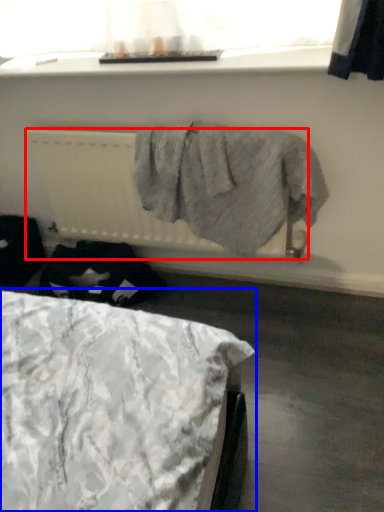
Question: Which of the following is the farthest to the observer, radiator (highlighted by a red box) or bed (highlighted by a blue box)?

Choices:
 (A) radiator
 (B) bed

Answer: (A)